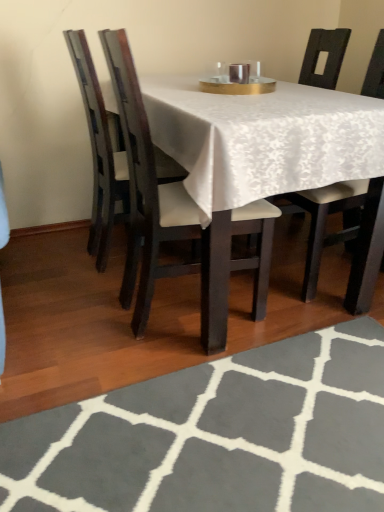
Question: Looking at the image, does dark wood chair at center, which is the 2th chair in right-to-left order, seem bigger or smaller compared to matte black chair at left, arranged as the first chair when viewed from the left?

Choices:
 (A) big
 (B) small

Answer: (A)

Question: From the image's perspective, is dark wood chair at center, which is the 2th chair in right-to-left order, located above or below matte black chair at left, arranged as the first chair when viewed from the left?

Choices:
 (A) above
 (B) below

Answer: (B)

Question: Which object is the closest to the dark wood chair at center, the second chair positioned from the left?

Choices:
 (A) white fabric chair at center, the third chair positioned from the left
 (B) gray woolen rug at lower center
 (C) matte black chair at left, positioned as the third chair in right-to-left order

Answer: (C)

Question: Which object is the closest to the matte black chair at left, arranged as the first chair when viewed from the left?

Choices:
 (A) dark wood chair at center, the second chair positioned from the left
 (B) white fabric chair at center, the third chair positioned from the left
 (C) gray woolen rug at lower center

Answer: (A)